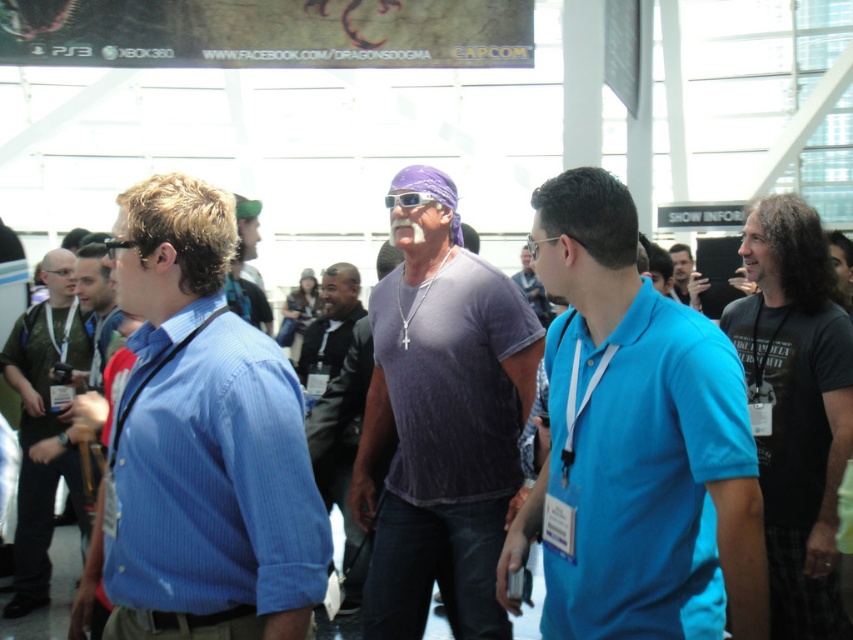
Is point (320, 358) closer to camera compared to point (691, 272)?

That is True.

Locate an element on the screen. purple knit sweater at center is located at coordinates (338, 403).

Does purple cotton t-shirt at center appear on the right side of purple knit sweater at center?

Yes, purple cotton t-shirt at center is to the right of purple knit sweater at center.

Between purple cotton t-shirt at center and purple knit sweater at center, which one is positioned lower?

purple knit sweater at center is lower down.

This screenshot has height=640, width=853. Describe the element at coordinates (440, 419) in the screenshot. I see `purple cotton t-shirt at center` at that location.

Where is `purple cotton t-shirt at center`? The height and width of the screenshot is (640, 853). purple cotton t-shirt at center is located at coordinates (440, 419).

Who is more distant from viewer, (346, 282) or (683, 284)?

The point (683, 284) is more distant.

Is black leather jacket at center wider than dark gray t-shirt at center?

No.

Who is more distant from viewer, (334, 276) or (689, 278)?

The point (689, 278) is behind.

Identify the location of black leather jacket at center. This screenshot has height=640, width=853. pos(331,323).